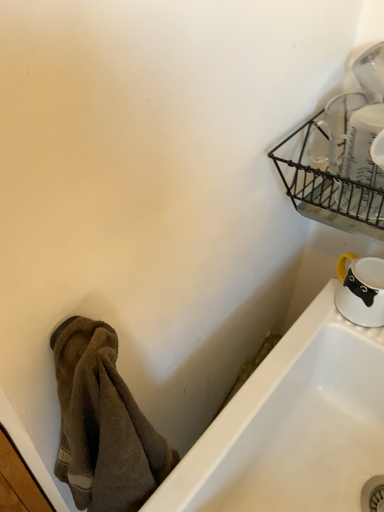
Question: From a real-world perspective, relative to white glossy mug at lower right, acting as the first tableware starting from the bottom, is clear glass measuring cups at upper right, which ranks as the 2th tableware in bottom-to-top order, vertically above or below?

Choices:
 (A) above
 (B) below

Answer: (A)

Question: Relative to white glossy mug at lower right, the 2th tableware when ordered from top to bottom, is clear glass measuring cups at upper right, which ranks as the 2th tableware in bottom-to-top order, in front or behind?

Choices:
 (A) behind
 (B) front

Answer: (B)

Question: Which object is the closest to the white glossy bathtub at lower right?

Choices:
 (A) white glossy mug at lower right, acting as the first tableware starting from the bottom
 (B) black wire basket at upper right
 (C) clear glass measuring cups at upper right, which appears as the first tableware when viewed from the front
 (D) brown fuzzy towel at lower left

Answer: (A)

Question: Which object is the farthest from the white glossy bathtub at lower right?

Choices:
 (A) clear glass measuring cups at upper right, which appears as the first tableware when viewed from the front
 (B) brown fuzzy towel at lower left
 (C) black wire basket at upper right
 (D) white glossy mug at lower right, arranged as the 2th tableware when viewed from the front

Answer: (A)